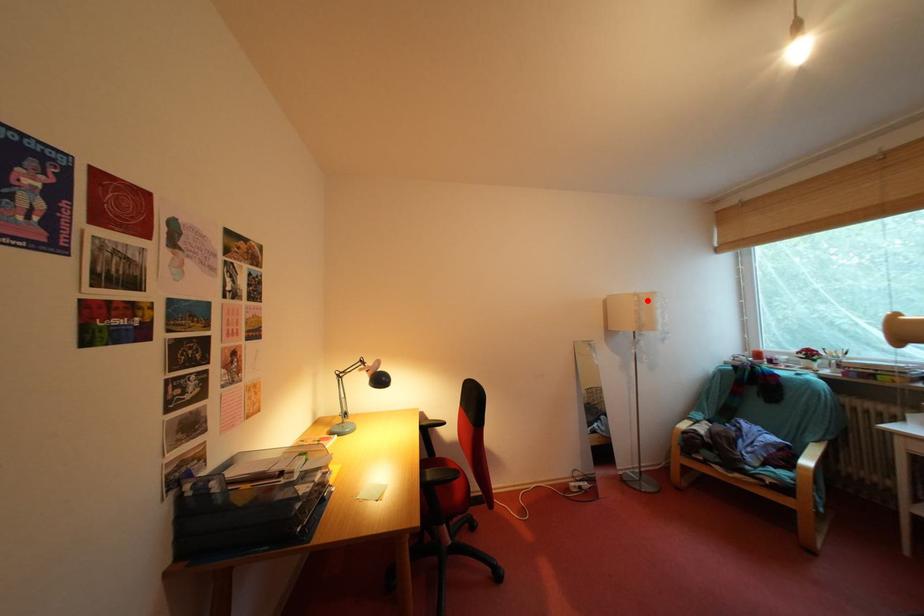
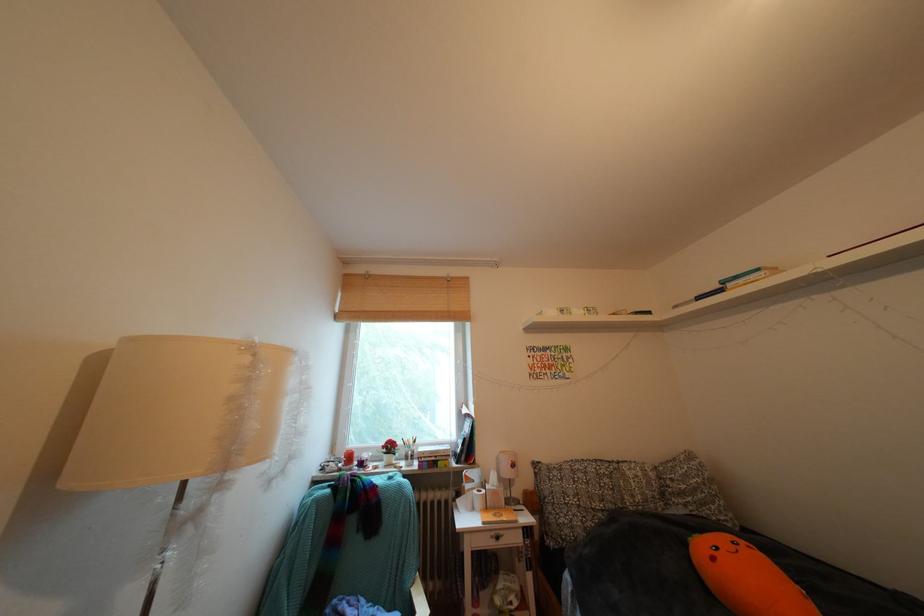
Where in the second image is the point corresponding to the highlighted location from the first image?

(259, 353)